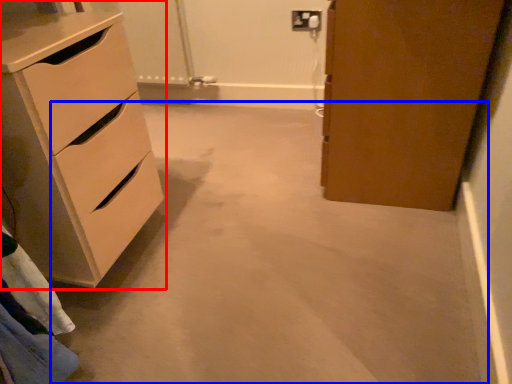
Question: Among these objects, which one is farthest to the camera, chest of drawers (highlighted by a red box) or concrete (highlighted by a blue box)?

Choices:
 (A) chest of drawers
 (B) concrete

Answer: (A)